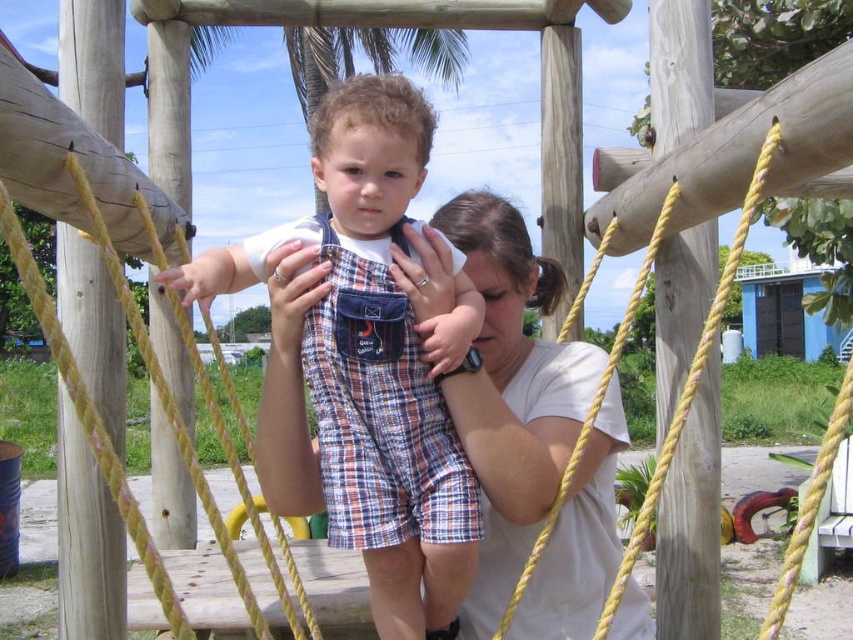
You are a clothing designer observing the playground scene. You need to determine which piece of clothing is more suitable for a child who prefers active play. Based on the sizes of the plaid cotton overalls at center and the white cotton shirt at center, which one would you recommend?

The plaid cotton overalls at center has a smaller size compared to the white cotton shirt at center, making it more appropriate for active play as overalls typically provide better coverage and mobility for a child.

Which of the two overalls, the plaid cotton overalls at center or the plaid fabric overalls at center, is wider?

The plaid cotton overalls at center is wider than the plaid fabric overalls at center according to the description.